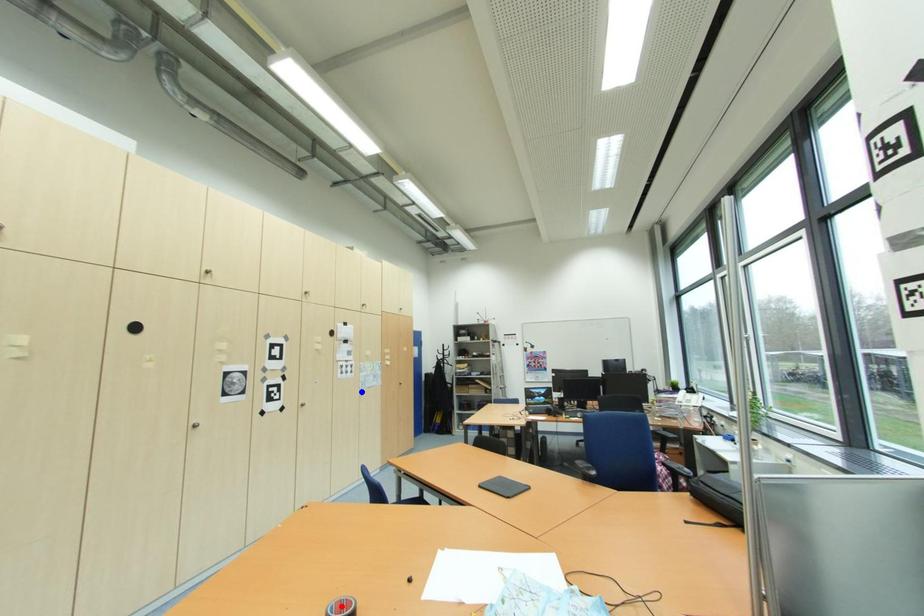
Question: Which of the two points in the image is closer to the camera?

Choices:
 (A) Blue point is closer.
 (B) Red point is closer.

Answer: (B)